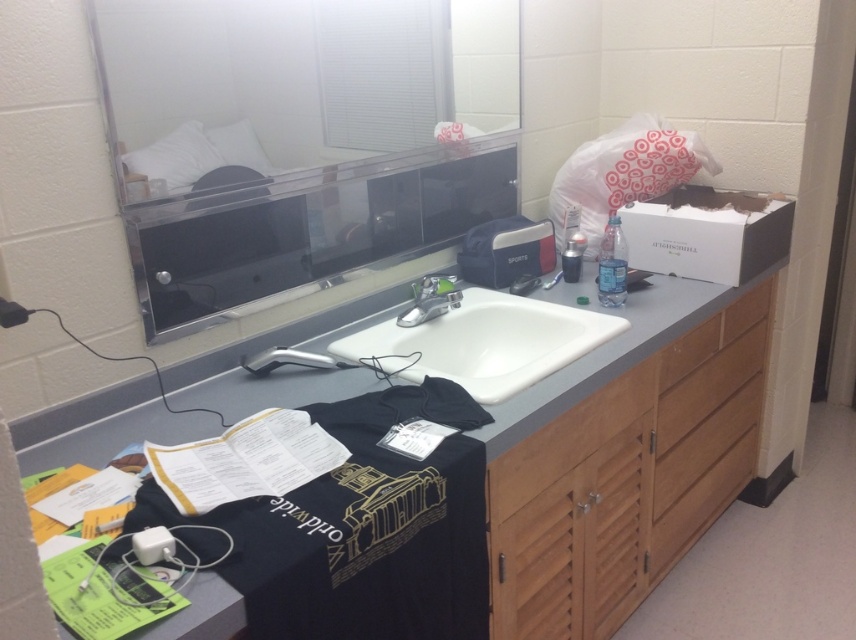
Question: Which point is farther to the camera?

Choices:
 (A) silver metallic faucet at center
 (B) clear glass mirror at upper center
 (C) clear plastic bottle at right
 (D) white ceramic sink at center

Answer: (C)

Question: Is the position of clear plastic bottle at right more distant than that of silver metallic faucet at center?

Choices:
 (A) no
 (B) yes

Answer: (B)

Question: Which is farther from the clear plastic bottle at upper right?

Choices:
 (A) clear glass mirror at upper center
 (B) black matte vanity at center

Answer: (A)

Question: Is clear glass mirror at upper center behind silver metallic faucet at center?

Choices:
 (A) no
 (B) yes

Answer: (A)

Question: Is clear glass mirror at upper center above black matte vanity at center?

Choices:
 (A) yes
 (B) no

Answer: (A)

Question: Which point appears closest to the camera in this image?

Choices:
 (A) click(x=407, y=323)
 (B) click(x=609, y=241)
 (C) click(x=411, y=54)

Answer: (A)